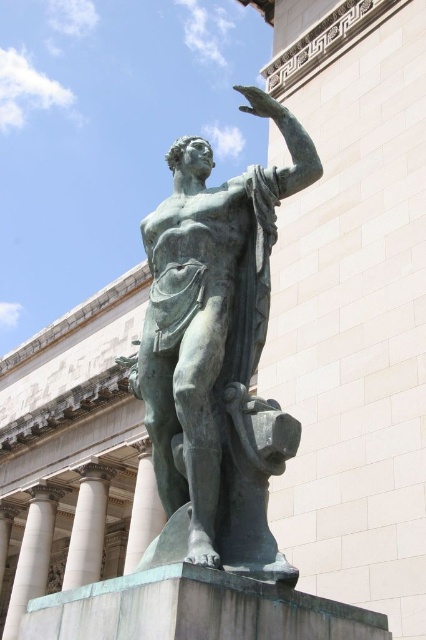
Question: Is white marble pillar at center thinner than bronze at center?

Choices:
 (A) no
 (B) yes

Answer: (B)

Question: Is green patina statue at center positioned before white marble pillar at center?

Choices:
 (A) yes
 (B) no

Answer: (A)

Question: Which of the following is the farthest from the observer?

Choices:
 (A) (129, 568)
 (B) (97, 566)

Answer: (B)

Question: Which is nearer to the white marble pillar at center?

Choices:
 (A) bronze at center
 (B) green patina statue at center
 (C) white marble pillar at lower left

Answer: (A)

Question: Is white marble pillar at lower left smaller than white marble pillar at center?

Choices:
 (A) yes
 (B) no

Answer: (B)

Question: Based on their relative distances, which object is nearer to the green patina statue at center?

Choices:
 (A) white marble pillar at center
 (B) bronze at center

Answer: (B)